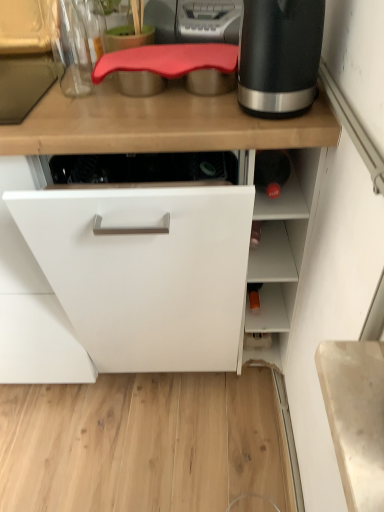
Question: Looking at the image, does black matte electric kettle at upper right seem bigger or smaller compared to rubberized red cutting board at upper center?

Choices:
 (A) big
 (B) small

Answer: (B)

Question: From the image's perspective, relative to rubberized red cutting board at upper center, is black matte electric kettle at upper right above or below?

Choices:
 (A) above
 (B) below

Answer: (B)

Question: Is point (296, 17) closer or farther from the camera than point (233, 41)?

Choices:
 (A) farther
 (B) closer

Answer: (B)

Question: Choose the correct answer: Is rubberized red cutting board at upper center inside black matte electric kettle at upper right or outside it?

Choices:
 (A) inside
 (B) outside

Answer: (B)

Question: Is point (221, 74) closer or farther from the camera than point (291, 26)?

Choices:
 (A) farther
 (B) closer

Answer: (A)

Question: From the image's perspective, relative to black matte electric kettle at upper right, is rubberized red cutting board at upper center above or below?

Choices:
 (A) below
 (B) above

Answer: (B)

Question: Would you say rubberized red cutting board at upper center is to the left or to the right of black matte electric kettle at upper right in the picture?

Choices:
 (A) right
 (B) left

Answer: (B)